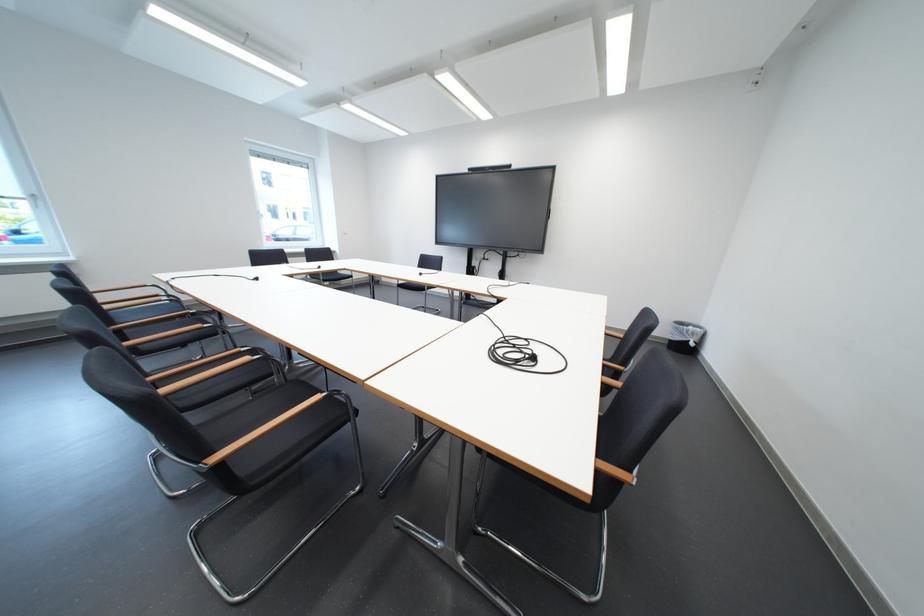
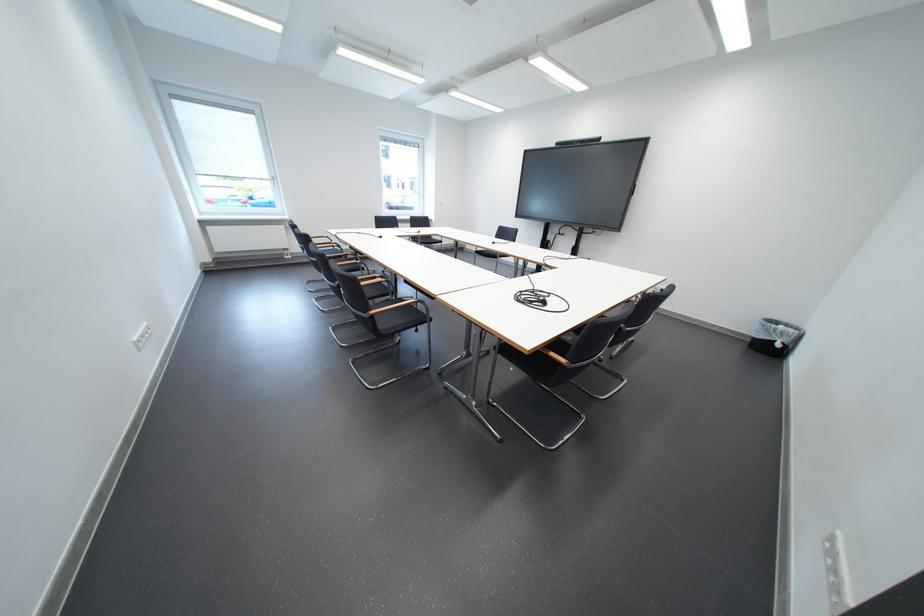
Locate, in the second image, the point that corresponds to the point at 694,334 in the first image.

(780, 333)